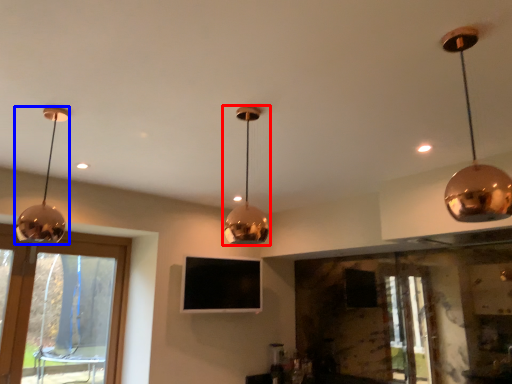
Question: Which object is closer to the camera taking this photo, lamp (highlighted by a red box) or lamp (highlighted by a blue box)?

Choices:
 (A) lamp
 (B) lamp

Answer: (A)